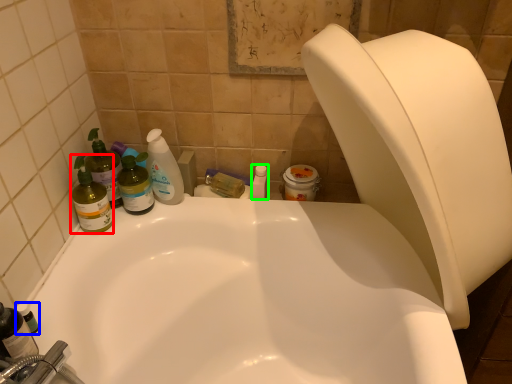
Question: Which object is the farthest from cleaning product (highlighted by a red box)? Choose among these: toiletry (highlighted by a blue box) or toiletry (highlighted by a green box).

Choices:
 (A) toiletry
 (B) toiletry

Answer: (B)